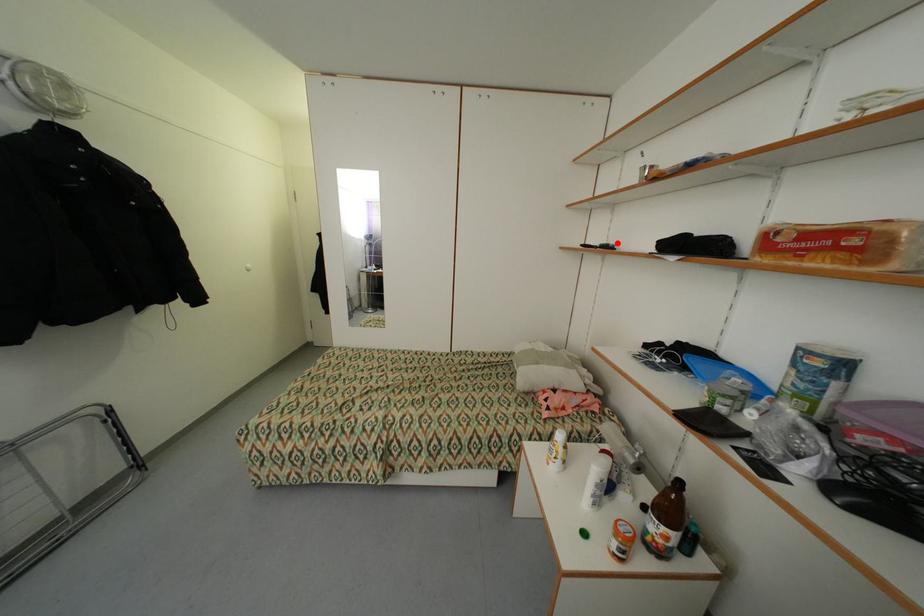
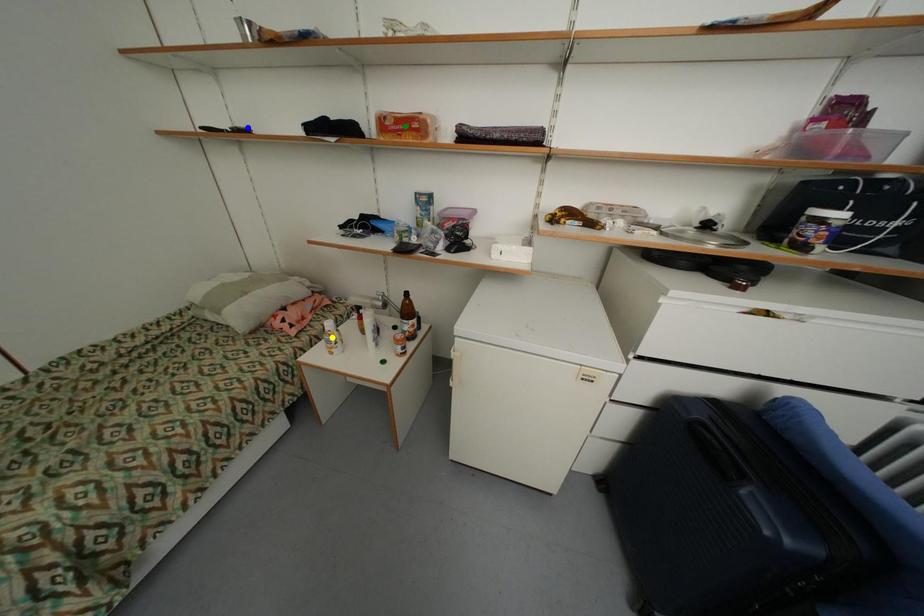
Question: I am providing you with two images of the same scene from different viewpoints. A red point is marked on the first image. You are given multiple points on the second image. Which spot in image 2 lines up with the point in image 1?

Choices:
 (A) blue point
 (B) yellow point
 (C) green point

Answer: (A)